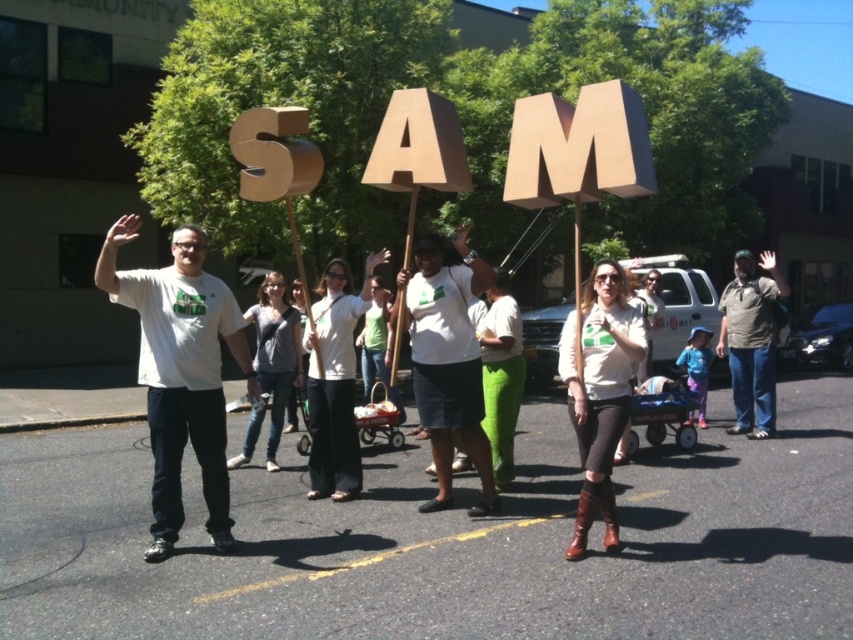
You are standing at the starting point of the parade route and want to reach the end point. You see two points marked on the ground ahead of you. The first point is at coordinates point (x=596, y=385), and the second point is at coordinates point (x=759, y=292). Which point should you head towards first to reach the end of the parade route?

You should head towards point (x=596, y=385) first because it is in front of point (x=759, y=292), so following the order of the points from front to back will lead you to the end of the parade route.

Where is the matte white sweater at center located in the image?

The matte white sweater at center is located at point (601, 392).